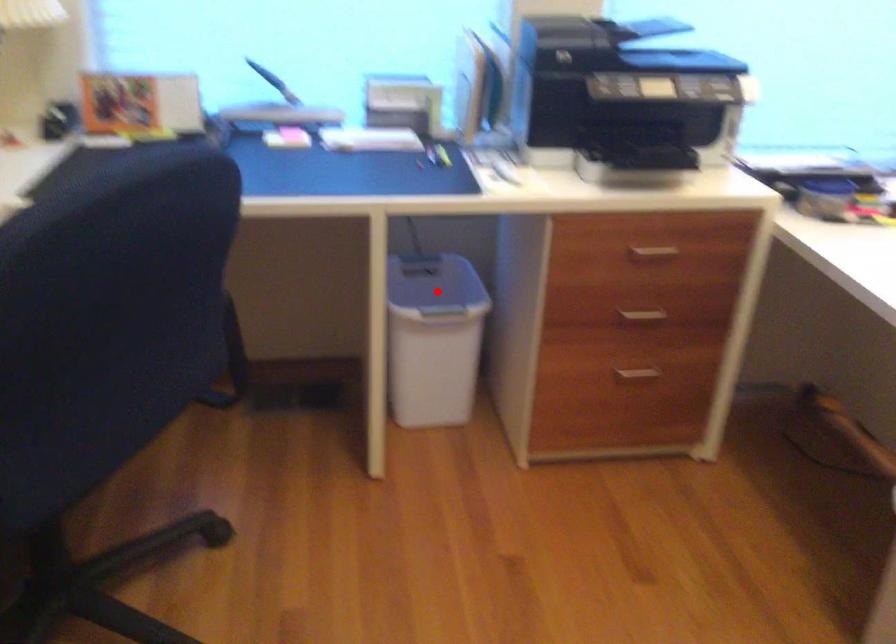
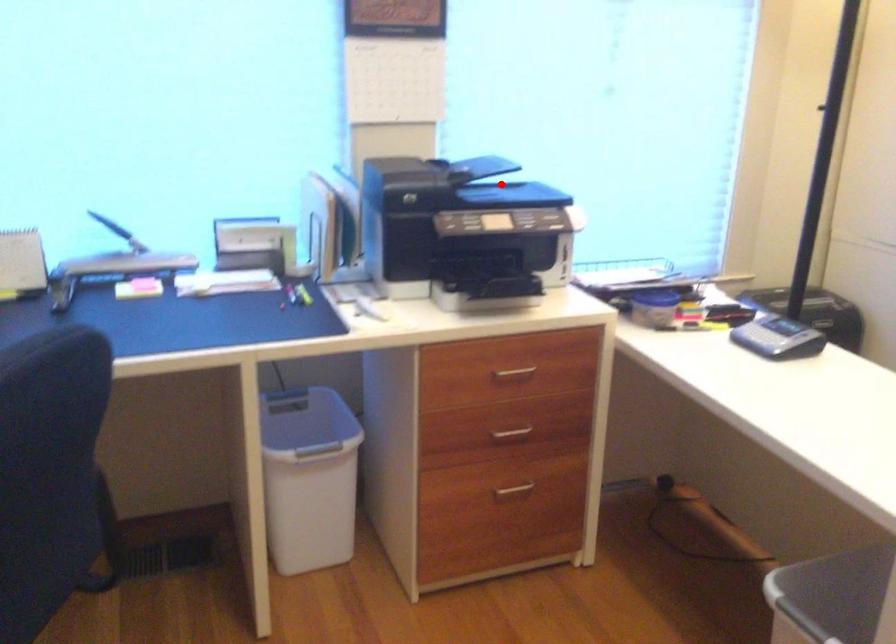
I am providing you with two images of the same scene from different viewpoints. A red point is marked on the first image and another point is marked on the second image. Are the points marked in image1 and image2 representing the same 3D position?

No